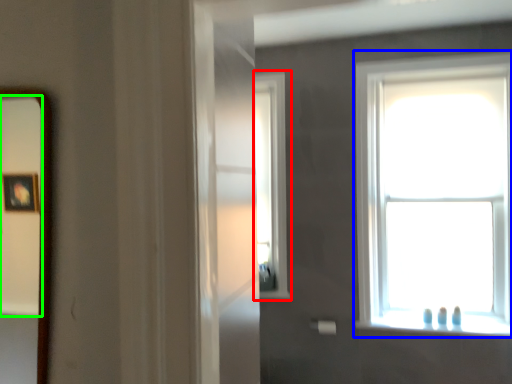
Question: Which object is the closest to the window (highlighted by a red box)? Choose among these: window (highlighted by a blue box) or mirror (highlighted by a green box).

Choices:
 (A) window
 (B) mirror

Answer: (A)